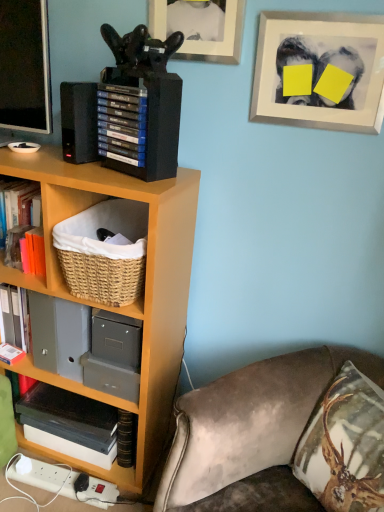
Question: From a real-world perspective, does wooden bookcase at left stand above black matte book at lower left?

Choices:
 (A) yes
 (B) no

Answer: (A)

Question: From the image's perspective, is wooden bookcase at left on top of black matte book at lower left?

Choices:
 (A) yes
 (B) no

Answer: (A)

Question: Is wooden bookcase at left oriented towards black matte book at lower left?

Choices:
 (A) no
 (B) yes

Answer: (B)

Question: Does wooden bookcase at left appear on the right side of black matte book at lower left?

Choices:
 (A) yes
 (B) no

Answer: (B)

Question: Is black matte book at lower left located within wooden bookcase at left?

Choices:
 (A) yes
 (B) no

Answer: (A)

Question: Does wooden bookcase at left have a lesser height compared to black matte book at lower left?

Choices:
 (A) no
 (B) yes

Answer: (A)

Question: Does wooden bookcase at left touch white matte picture frame at upper right, which is counted as the 2th picture frame, starting from the left?

Choices:
 (A) yes
 (B) no

Answer: (B)

Question: Would you consider wooden bookcase at left to be distant from white matte picture frame at upper right, which is counted as the 2th picture frame, starting from the left?

Choices:
 (A) no
 (B) yes

Answer: (A)

Question: From the image's perspective, is wooden bookcase at left on white matte picture frame at upper right, the 1th picture frame viewed from the right?

Choices:
 (A) no
 (B) yes

Answer: (A)

Question: Can you confirm if wooden bookcase at left is positioned to the left of white matte picture frame at upper right, the 1th picture frame viewed from the right?

Choices:
 (A) no
 (B) yes

Answer: (B)

Question: Is wooden bookcase at left taller than white matte picture frame at upper right, the 1th picture frame viewed from the right?

Choices:
 (A) yes
 (B) no

Answer: (A)

Question: From a real-world perspective, is wooden bookcase at left physically below white matte picture frame at upper right, the 1th picture frame viewed from the right?

Choices:
 (A) yes
 (B) no

Answer: (A)

Question: From a real-world perspective, does woven natural basket at lower left sit lower than blue matte game cases at upper left?

Choices:
 (A) no
 (B) yes

Answer: (B)